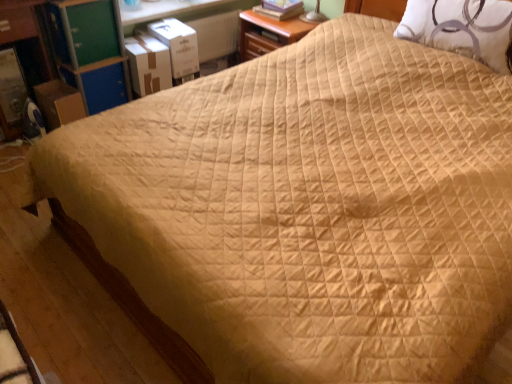
Find the location of `empty space that is ontop of white cardboard box at upper left, acting as the 2th cardboard box starting from the right (from a real-world perspective)`. empty space that is ontop of white cardboard box at upper left, acting as the 2th cardboard box starting from the right (from a real-world perspective) is located at coordinates [145, 42].